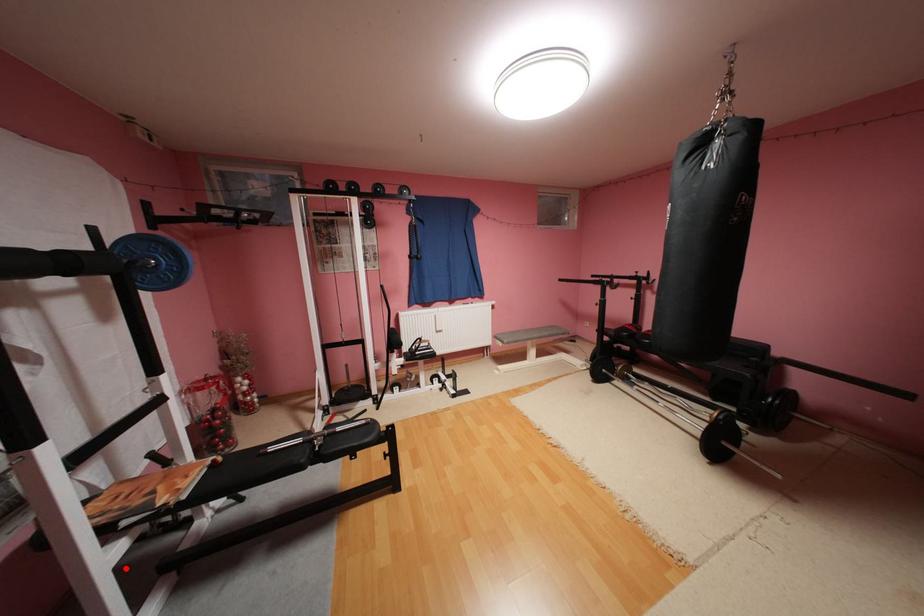
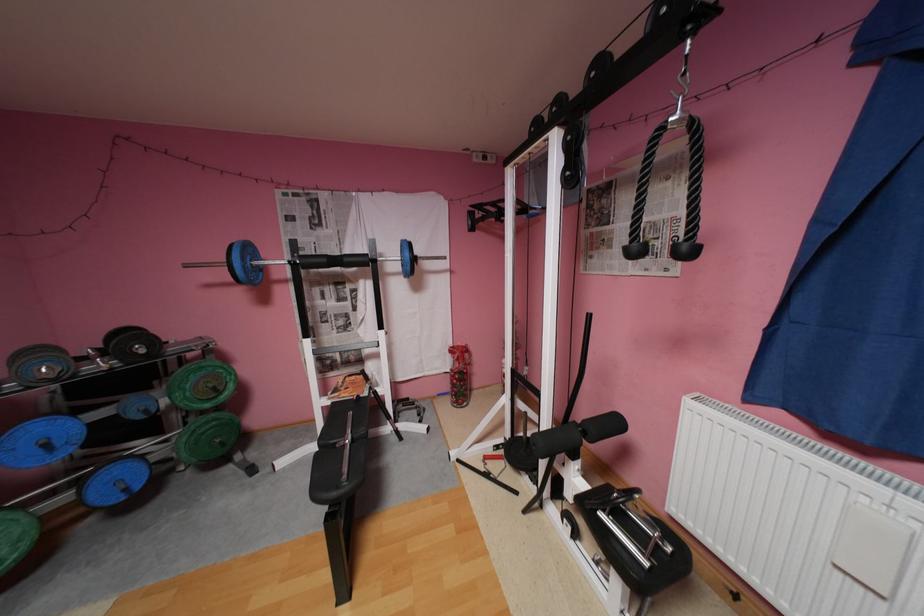
Question: I am providing you with two images of the same scene from different viewpoints. Given a red point in image1, look at the same physical point in image2. Is it:

Choices:
 (A) Closer to the viewpoint
 (B) Farther from the viewpoint

Answer: (B)